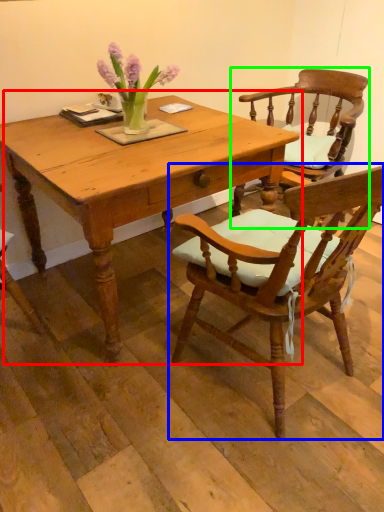
Question: Which object is positioned closest to table (highlighted by a red box)? Select from chair (highlighted by a blue box) and chair (highlighted by a green box).

Choices:
 (A) chair
 (B) chair

Answer: (A)